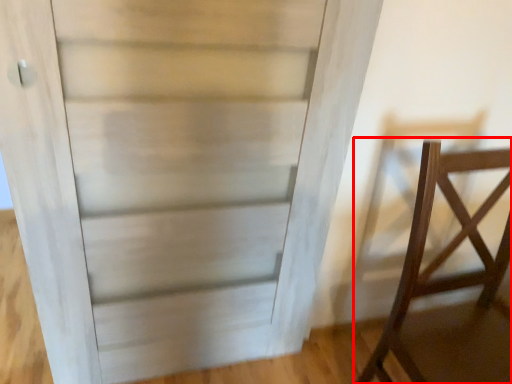
Question: In this image, where is furniture (annotated by the red box) located relative to door?

Choices:
 (A) left
 (B) right

Answer: (B)